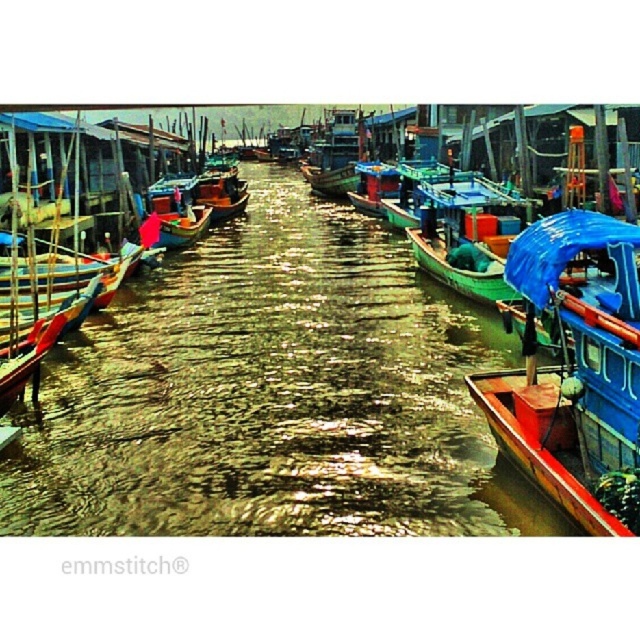
Does wooden boat at center have a smaller size compared to green matte canoe at center?

Incorrect, wooden boat at center is not smaller in size than green matte canoe at center.

Does wooden boat at center have a lesser height compared to green matte canoe at center?

No, wooden boat at center is not shorter than green matte canoe at center.

Is point (164, 180) positioned after point (436, 257)?

Yes, point (164, 180) is farther from viewer.

This screenshot has height=640, width=640. What are the coordinates of `wooden boat at center` in the screenshot? It's located at (177, 211).

You are a GUI agent. You are given a task and a screenshot of the screen. Output one action in this format:
    pyautogui.click(x=<x>, y=<y>)
    Task: Click on the wooden canoe at right
    
    Given the screenshot: What is the action you would take?
    pyautogui.click(x=541, y=442)

Is wooden canoe at right shorter than green matte canoe at center?

Indeed, wooden canoe at right has a lesser height compared to green matte canoe at center.

Is point (532, 413) in front of point (435, 276)?

Yes, point (532, 413) is closer to viewer.

Find the location of a particular element. wooden canoe at right is located at coordinates (541, 442).

Can you confirm if wooden canoe at right is positioned to the right of wooden boat at center?

Indeed, wooden canoe at right is positioned on the right side of wooden boat at center.

Can you confirm if wooden canoe at right is positioned to the left of wooden boat at center?

In fact, wooden canoe at right is to the right of wooden boat at center.

Identify the location of wooden canoe at right. The width and height of the screenshot is (640, 640). (541, 442).

You are a GUI agent. You are given a task and a screenshot of the screen. Output one action in this format:
    pyautogui.click(x=<x>, y=<y>)
    Task: Click on the wooden canoe at right
    This screenshot has height=640, width=640.
    Given the screenshot: What is the action you would take?
    pyautogui.click(x=541, y=442)